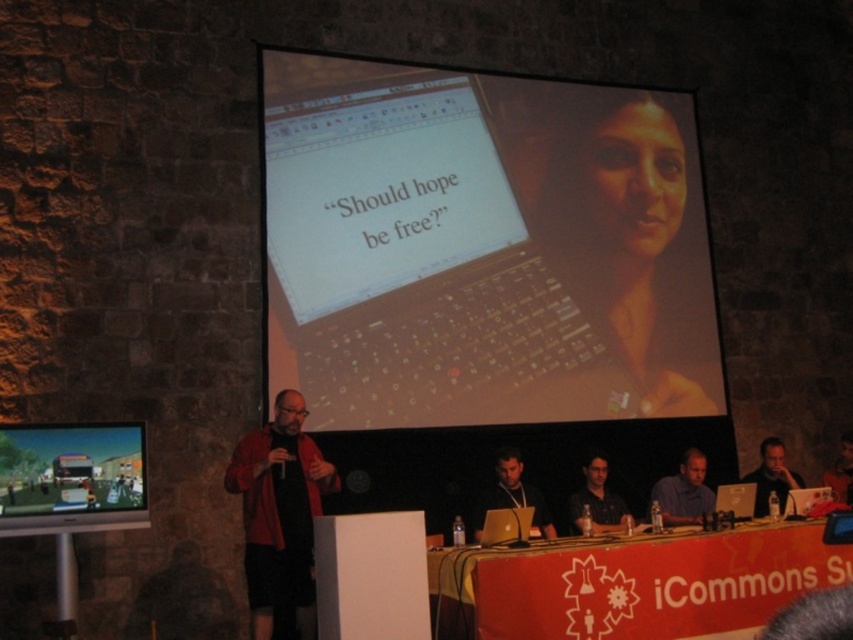
You are a photographer setting up for the presentation. You need to place a small light between the two points, point (693, 465) and point (753, 502). Which point should the light be closer to in order to be nearer to the audience?

The light should be closer to point (753, 502) because point (693, 465) is closer to the viewer, meaning point (753, 502) is further back towards the audience.

Consider the image. You are an event organizer who needs to place a 2 meter wide banner between the dark hair at center and the dark brown leather jacket at upper center. Is there enough space?

The dark hair at center and dark brown leather jacket at upper center are 3.33 meters apart from each other. Since the banner is 2 meters wide, there is sufficient space to place it between them.